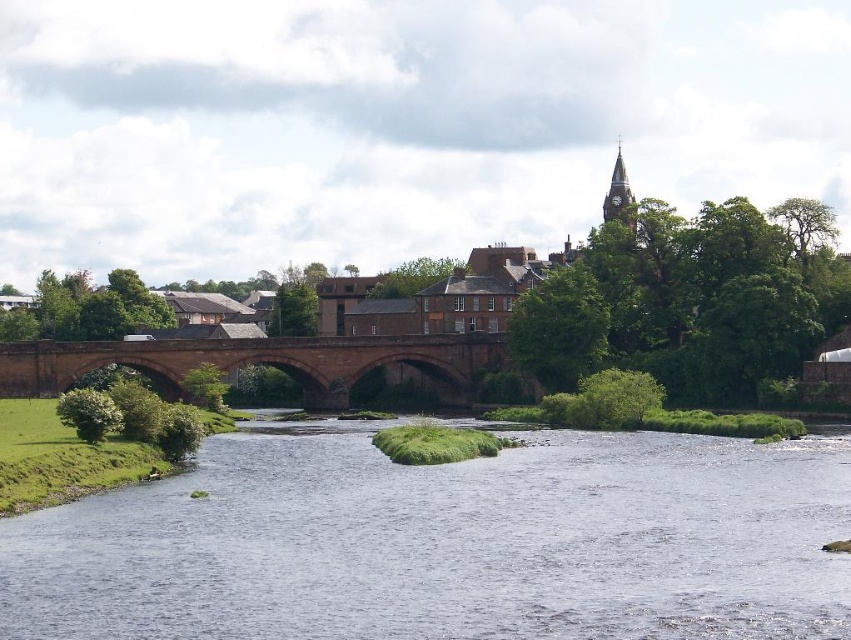
Question: Can you confirm if matte brick bridge at center is positioned below matte stone bridge at center?

Choices:
 (A) no
 (B) yes

Answer: (A)

Question: Which object appears closest to the camera in this image?

Choices:
 (A) matte stone bridge at center
 (B) matte brick bridge at center

Answer: (B)

Question: Estimate the real-world distances between objects in this image. Which object is farther from the matte brick bridge at center?

Choices:
 (A) matte stone bridge at center
 (B) clear water at center

Answer: (B)

Question: Does matte brick bridge at center appear on the left side of matte stone bridge at center?

Choices:
 (A) yes
 (B) no

Answer: (B)

Question: Is clear water at center to the left of matte brick bridge at center from the viewer's perspective?

Choices:
 (A) yes
 (B) no

Answer: (A)

Question: Which of the following is the closest to the observer?

Choices:
 (A) clear water at center
 (B) matte brick bridge at center

Answer: (A)